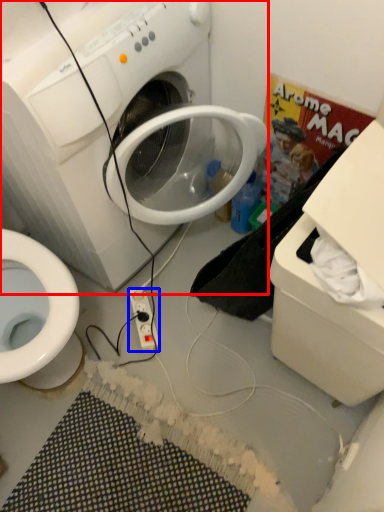
Question: Among these objects, which one is nearest to the camera, washing machine (highlighted by a red box) or power outlet (highlighted by a blue box)?

Choices:
 (A) washing machine
 (B) power outlet

Answer: (A)